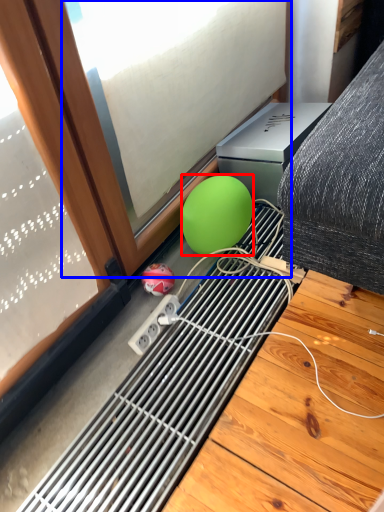
Question: Which point is further to the camera, ball (highlighted by a red box) or window (highlighted by a blue box)?

Choices:
 (A) ball
 (B) window

Answer: (A)